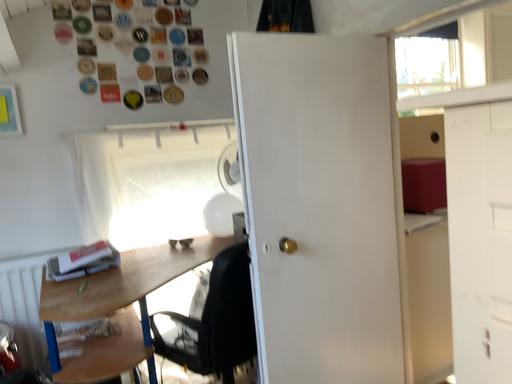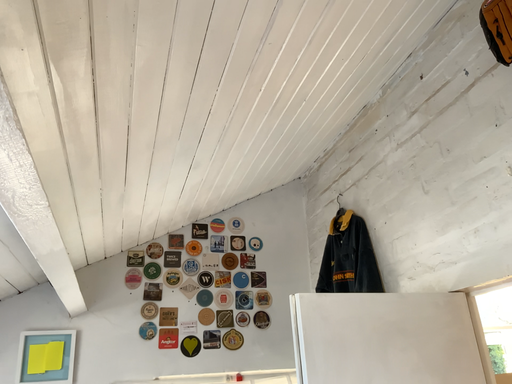
Question: Which way did the camera rotate in the video?

Choices:
 (A) rotated left
 (B) rotated right

Answer: (A)